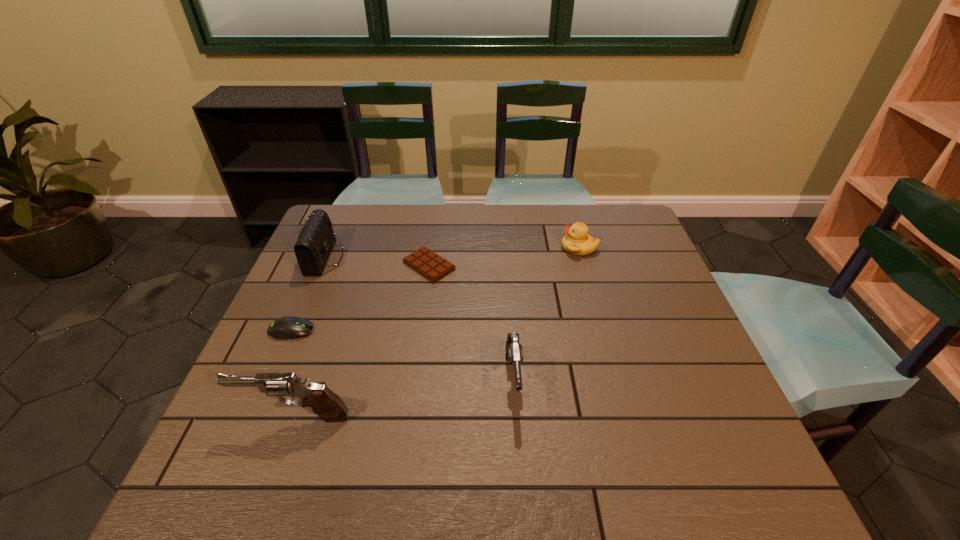
You are a GUI agent. You are given a task and a screenshot of the screen. Output one action in this format:
    pyautogui.click(x=<x>, y=<y>)
    Task: Click on the blank space at the near left corner of the desktop
    The image size is (960, 540).
    Given the screenshot: What is the action you would take?
    pyautogui.click(x=269, y=430)

I want to click on vacant space that is in between the duckling and the right pistol, so click(x=546, y=314).

The image size is (960, 540). I want to click on vacant point located between the taller pistol and the clutch bag, so click(310, 337).

Locate an element on the screen. The width and height of the screenshot is (960, 540). unoccupied position between the fourth object from left to right and the left pistol is located at coordinates (362, 341).

Identify the location of vacant area that lies between the duckling and the computer mouse. The image size is (960, 540). click(x=435, y=289).

At what (x,y) coordinates should I click in order to perform the action: click on vacant space that is in between the rightmost object and the taller pistol. Please return your answer as a coordinate pair (x, y). The image size is (960, 540). Looking at the image, I should click on (438, 332).

Locate an element on the screen. Image resolution: width=960 pixels, height=540 pixels. vacant region between the clutch bag and the tallest object is located at coordinates (310, 337).

This screenshot has width=960, height=540. Identify the location of free space between the clutch bag and the computer mouse. (308, 294).

You are a GUI agent. You are given a task and a screenshot of the screen. Output one action in this format:
    pyautogui.click(x=<x>, y=<y>)
    Task: Click on the free space that is in between the third nearest object and the clutch bag
    The height and width of the screenshot is (540, 960).
    Given the screenshot: What is the action you would take?
    pyautogui.click(x=308, y=294)

Locate an element on the screen. This screenshot has width=960, height=540. empty space between the tallest object and the duckling is located at coordinates (438, 332).